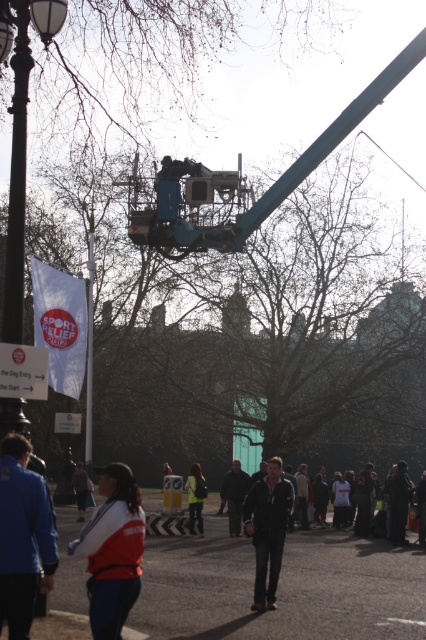
You are at a public event and need to locate the reflective yellow vest at center. Which direction should you move from the black metal lamp post at left to find it?

The reflective yellow vest at center is to the right of the black metal lamp post at left, so you should move to the right from the black metal lamp post at left to find it.

You are organizing an outdoor event and need to identify which clothing item is more suitable for visibility during nighttime activities. Based on the scene, which item, the dark blue jacket at center or the reflective yellow vest at center, would be better for ensuring visibility?

The reflective yellow vest at center is better for ensuring visibility during nighttime activities because it is larger and more reflective compared to the dark blue jacket at center.

You are standing in the park and see two points marked in the image. Which point, point (20, 406) or point (196, 472), is closer to you?

Point (20, 406) is closer to the viewer than point (196, 472).